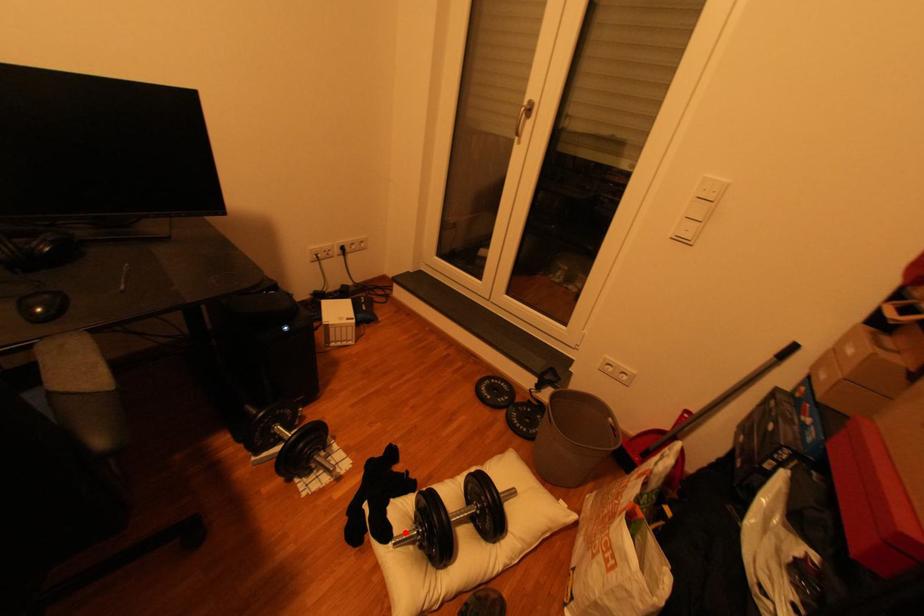
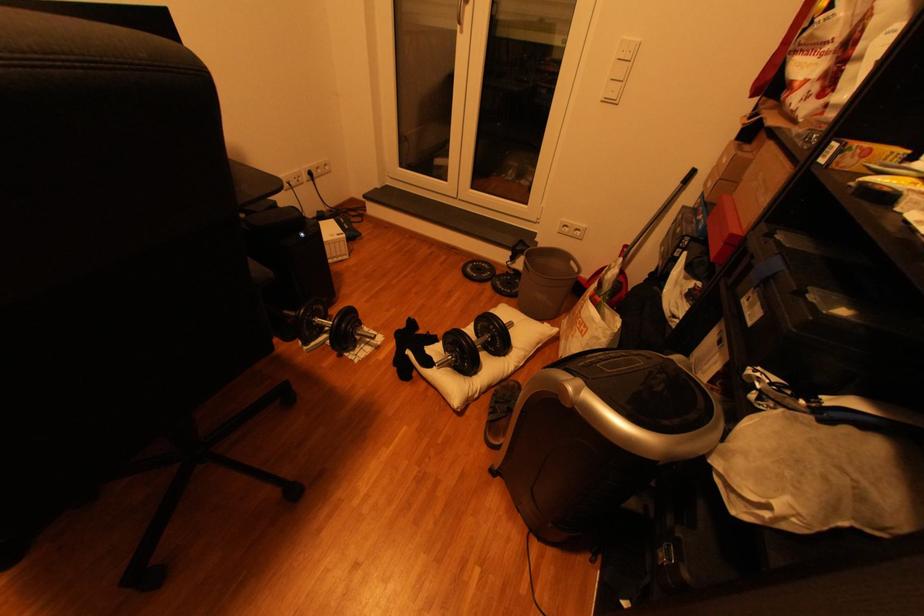
Question: I am providing you with two images of the same scene from different viewpoints. Given a red point in image1, look at the same physical point in image2. Is it:

Choices:
 (A) Closer to the viewpoint
 (B) Farther from the viewpoint

Answer: (B)